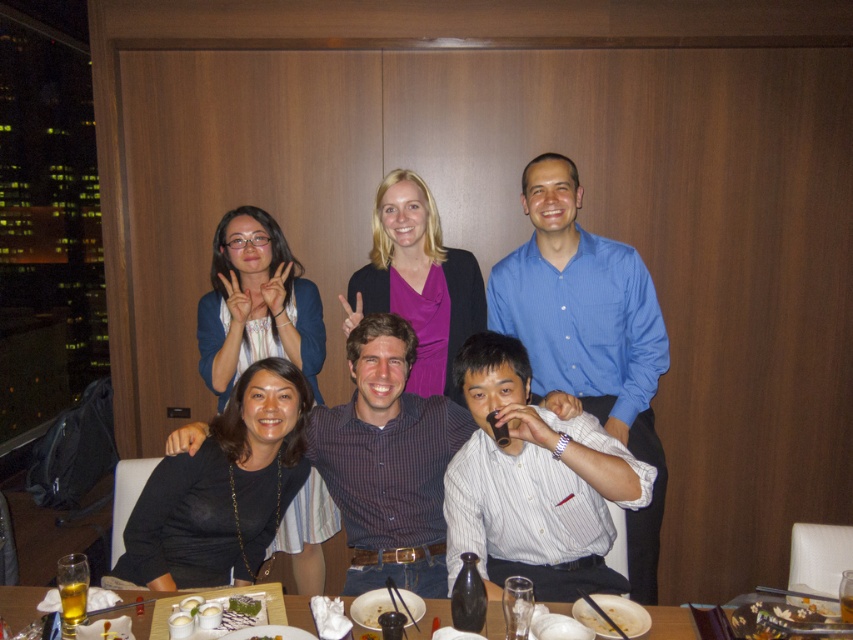
What do you see at coordinates (19, 604) in the screenshot? I see `wooden table at lower center` at bounding box center [19, 604].

Is the position of wooden table at lower center more distant than that of white glossy bowl at lower center?

Yes, it is behind white glossy bowl at lower center.

What are the coordinates of `wooden table at lower center` in the screenshot? It's located at click(19, 604).

Consider the image. Between matte blue sweater at upper left and wooden table at lower center, which one has less height?

wooden table at lower center is shorter.

Does point (280, 288) come in front of point (149, 596)?

No.

Find the location of `matte blue sweater at upper left`. matte blue sweater at upper left is located at coordinates (256, 301).

Does matte black shirt at center appear on the right side of white glossy bowl at lower center?

Correct, you'll find matte black shirt at center to the right of white glossy bowl at lower center.

Which is more to the left, matte black shirt at center or white glossy bowl at lower center?

From the viewer's perspective, white glossy bowl at lower center appears more on the left side.

Does point (663, 372) come farther from viewer compared to point (173, 625)?

Yes.

At what (x,y) coordinates should I click in order to perform the action: click on matte black shirt at center. Please return your answer as a coordinate pair (x, y). Looking at the image, I should click on click(633, 422).